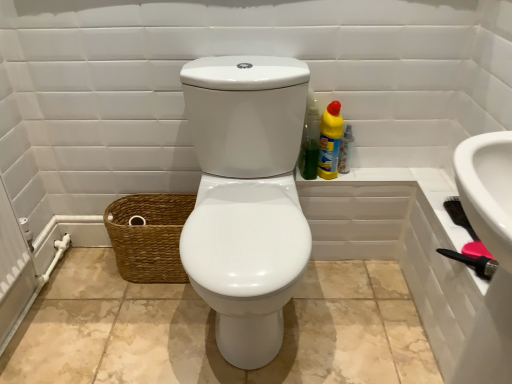
Question: Can you see green plastic bottle at upper right, positioned as the second cleaning product in right-to-left order, touching brown woven basket at lower left?

Choices:
 (A) no
 (B) yes

Answer: (A)

Question: Is green plastic bottle at upper right, placed as the first cleaning product when sorted from left to right, not near brown woven basket at lower left?

Choices:
 (A) yes
 (B) no

Answer: (B)

Question: Is green plastic bottle at upper right, placed as the first cleaning product when sorted from left to right, thinner than brown woven basket at lower left?

Choices:
 (A) no
 (B) yes

Answer: (B)

Question: Can you confirm if green plastic bottle at upper right, positioned as the second cleaning product in right-to-left order, is taller than brown woven basket at lower left?

Choices:
 (A) no
 (B) yes

Answer: (B)

Question: Considering the relative sizes of green plastic bottle at upper right, placed as the first cleaning product when sorted from left to right, and brown woven basket at lower left in the image provided, is green plastic bottle at upper right, placed as the first cleaning product when sorted from left to right, shorter than brown woven basket at lower left?

Choices:
 (A) yes
 (B) no

Answer: (B)

Question: From a real-world perspective, is green plastic bottle at upper right, placed as the first cleaning product when sorted from left to right, below brown woven basket at lower left?

Choices:
 (A) no
 (B) yes

Answer: (A)

Question: From a real-world perspective, is brown woven basket at lower left located beneath green plastic bottle at upper right, placed as the first cleaning product when sorted from left to right?

Choices:
 (A) yes
 (B) no

Answer: (A)

Question: Can you confirm if brown woven basket at lower left is taller than green plastic bottle at upper right, placed as the first cleaning product when sorted from left to right?

Choices:
 (A) no
 (B) yes

Answer: (A)

Question: Considering the relative positions of brown woven basket at lower left and green plastic bottle at upper right, positioned as the second cleaning product in right-to-left order, in the image provided, is brown woven basket at lower left behind green plastic bottle at upper right, positioned as the second cleaning product in right-to-left order,?

Choices:
 (A) yes
 (B) no

Answer: (A)

Question: Does brown woven basket at lower left have a lesser height compared to green plastic bottle at upper right, placed as the first cleaning product when sorted from left to right?

Choices:
 (A) yes
 (B) no

Answer: (A)

Question: Could you tell me if brown woven basket at lower left is turned towards green plastic bottle at upper right, placed as the first cleaning product when sorted from left to right?

Choices:
 (A) yes
 (B) no

Answer: (B)

Question: From a real-world perspective, is brown woven basket at lower left on top of green plastic bottle at upper right, placed as the first cleaning product when sorted from left to right?

Choices:
 (A) no
 (B) yes

Answer: (A)

Question: Is brown woven basket at lower left facing away from translucent plastic spray bottle at right?

Choices:
 (A) yes
 (B) no

Answer: (B)